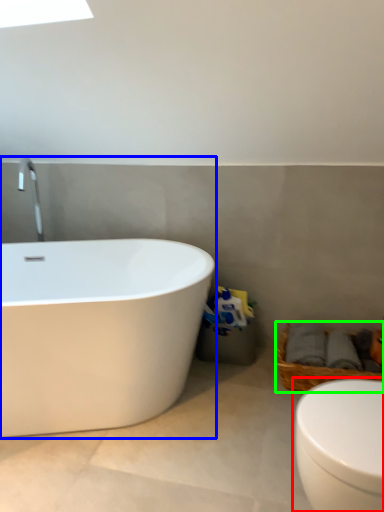
Question: Which object is the farthest from toilet (highlighted by a red box)? Choose among these: bathtub (highlighted by a blue box) or basket (highlighted by a green box).

Choices:
 (A) bathtub
 (B) basket

Answer: (A)